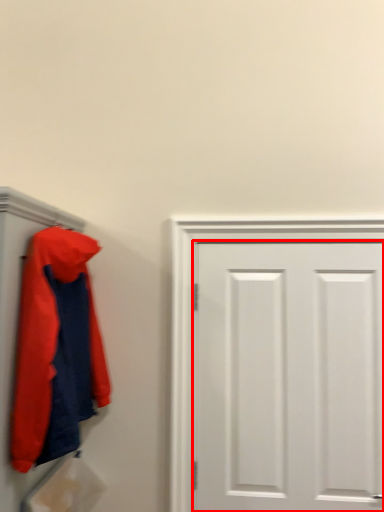
Question: Observing the image, what is the correct spatial positioning of door (annotated by the red box) in reference to jacket?

Choices:
 (A) right
 (B) left

Answer: (A)